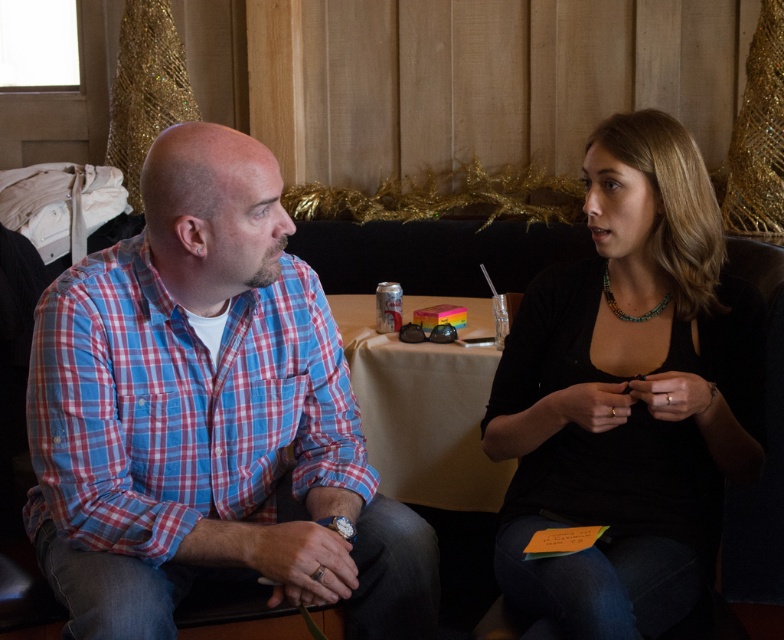
Is blue plaid shirt at left below black matte shirt at center?

Indeed, blue plaid shirt at left is positioned under black matte shirt at center.

Which is in front, point (278, 573) or point (732, 380)?

Point (278, 573) is more forward.

Locate an element on the screen. blue plaid shirt at left is located at coordinates (209, 417).